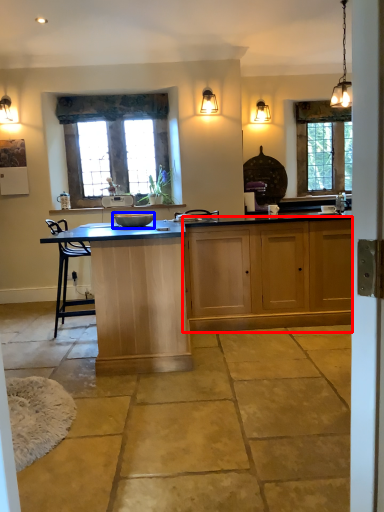
Question: Which point is further to the camera, cabinetry (highlighted by a red box) or appliance (highlighted by a blue box)?

Choices:
 (A) cabinetry
 (B) appliance

Answer: (A)